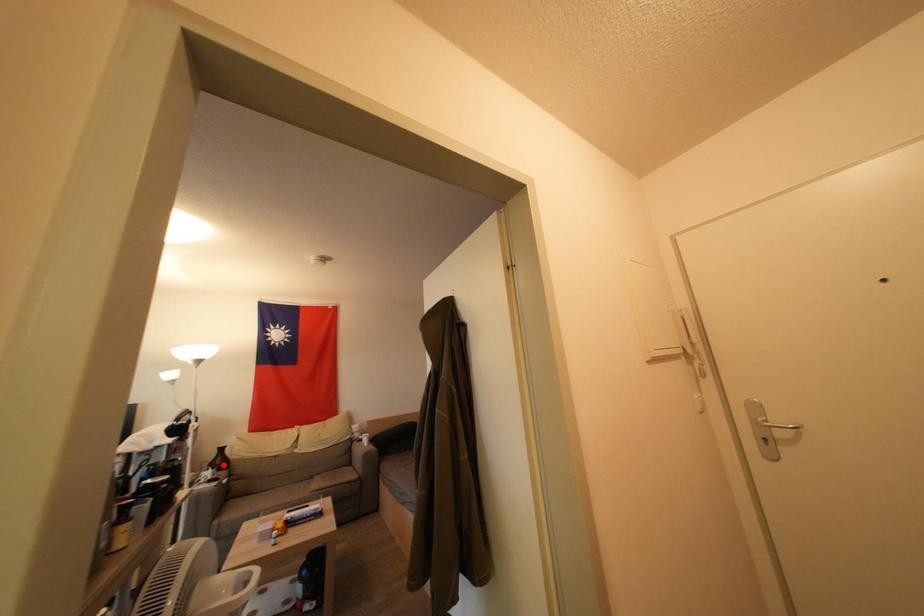
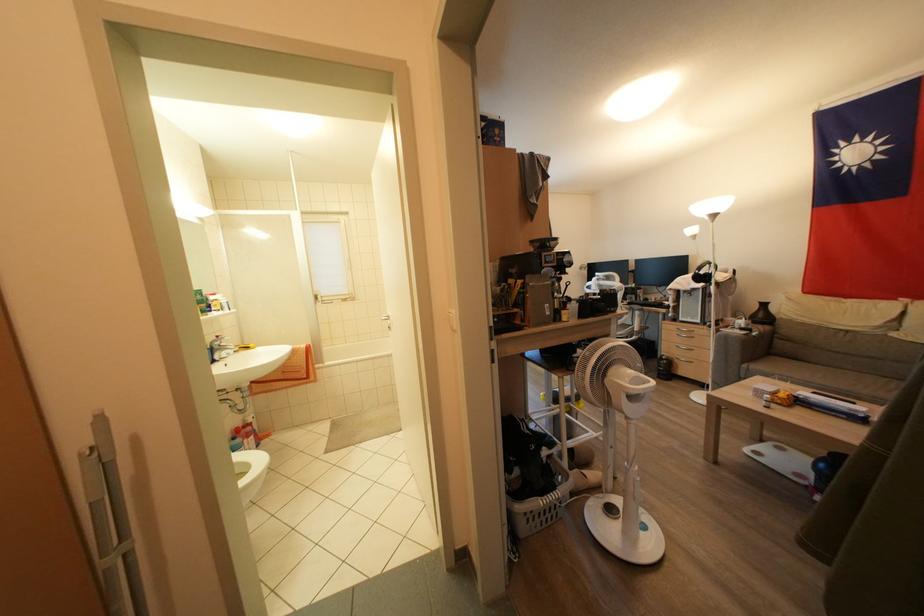
Find the pixel in the second image that matches the highlighted location in the first image.

(766, 320)